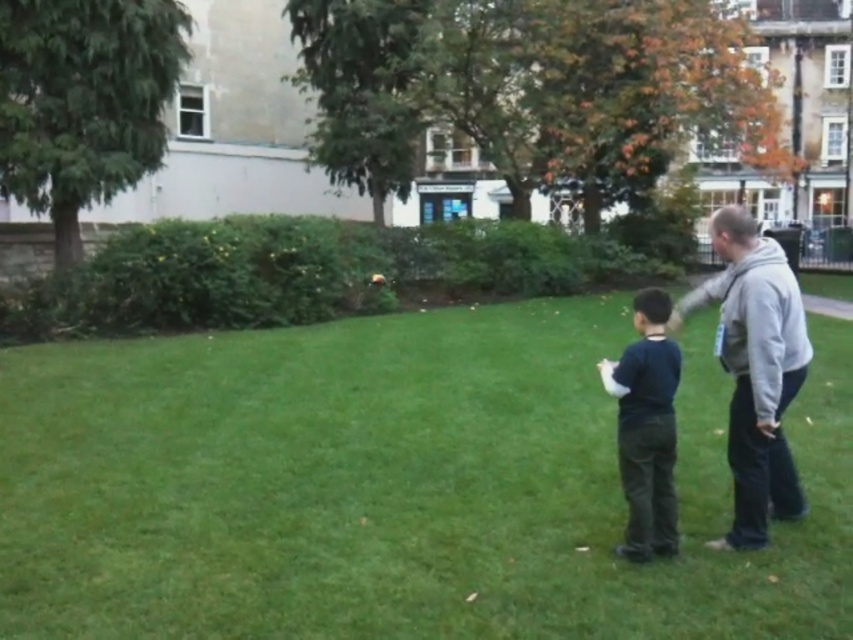
Question: Is green grass at center behind dark blue shirt at center?

Choices:
 (A) yes
 (B) no

Answer: (A)

Question: Which of the following is the closest to the observer?

Choices:
 (A) gray fleece jacket at right
 (B) green grass at center
 (C) dark blue shirt at center

Answer: (C)

Question: Which object appears closest to the camera in this image?

Choices:
 (A) dark blue shirt at center
 (B) gray fleece jacket at right
 (C) green grass at center

Answer: (A)

Question: From the image, what is the correct spatial relationship of green grass at center in relation to dark blue shirt at center?

Choices:
 (A) above
 (B) below

Answer: (B)

Question: Which of these objects is positioned farthest from the gray fleece jacket at right?

Choices:
 (A) dark blue shirt at center
 (B) green grass at center

Answer: (B)

Question: Observing the image, what is the correct spatial positioning of gray fleece jacket at right in reference to dark blue shirt at center?

Choices:
 (A) below
 (B) above

Answer: (B)